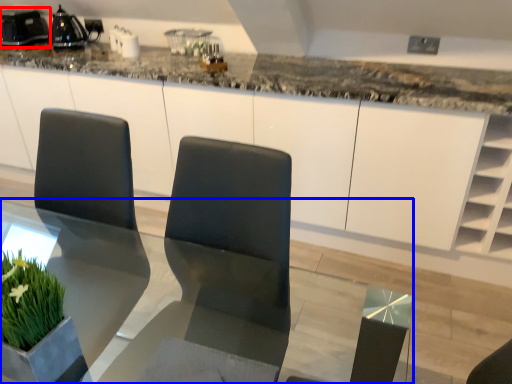
Question: Which object is closer to the camera taking this photo, appliance (highlighted by a red box) or table (highlighted by a blue box)?

Choices:
 (A) appliance
 (B) table

Answer: (B)